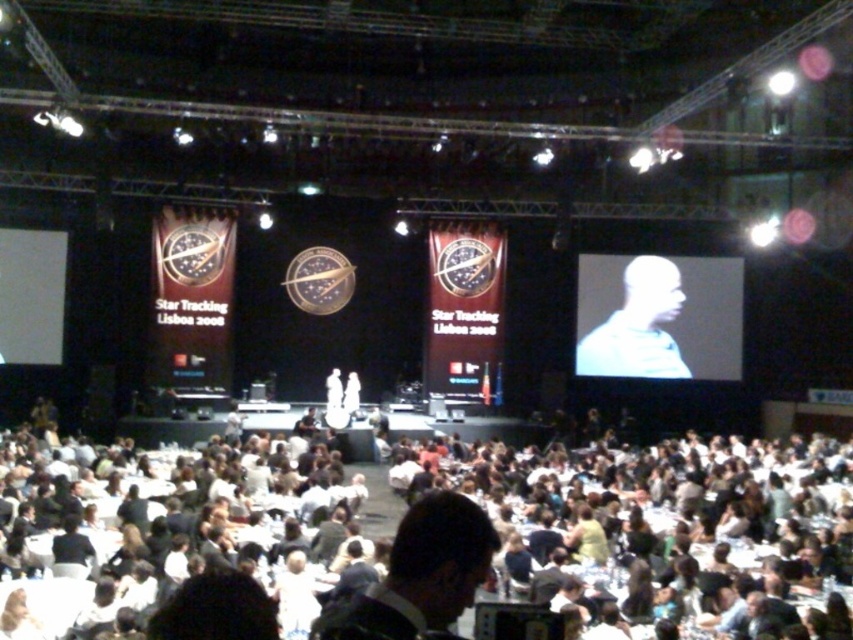
You are attending the Star Tracking Lisboa 2008 event and standing at the back of the venue. You notice two points marked in the scene. The first point is at coordinates point (604, 337) and the second point is at point (437, 497). Which point is closer to you?

Point (604, 337) is further to the viewer than point (437, 497), so the closer point to you is point (437, 497).